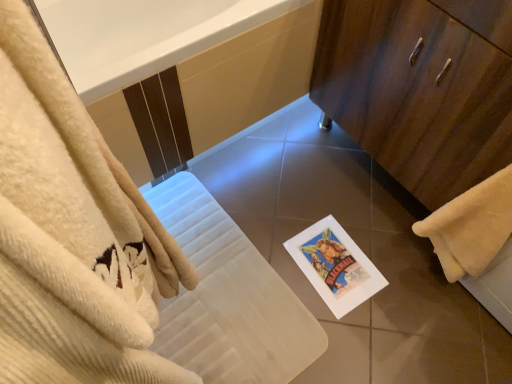
Locate an element on the screen. free location to the left of white paper postcard at center is located at coordinates (276, 253).